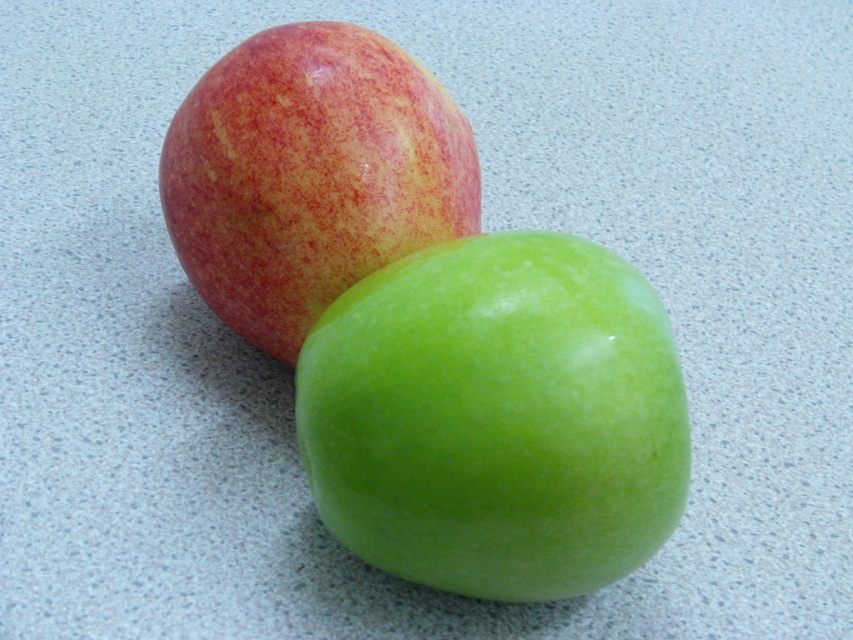
You are looking at the two apples on the countertop. The first apple is at point (585,292) and the second is at point (194,195). Which apple is closer to you?

The apple at point (585,292) is closer to you because it is closer to the camera than the apple at point (194,195).

You are standing in front of a countertop with two apples. There is a point marked at coordinates (497, 417). Which apple is this point located on?

The point at coordinates (497, 417) is located on the green shiny apple at center.

You are arranging apples on a countertop for a display. You have a green shiny apple at center and a matte red apple at upper left. According to the image, where should you place the green shiny apple relative to the matte red apple to match the original arrangement?

The green shiny apple at center should be placed to the right of the matte red apple at upper left to match the original arrangement.